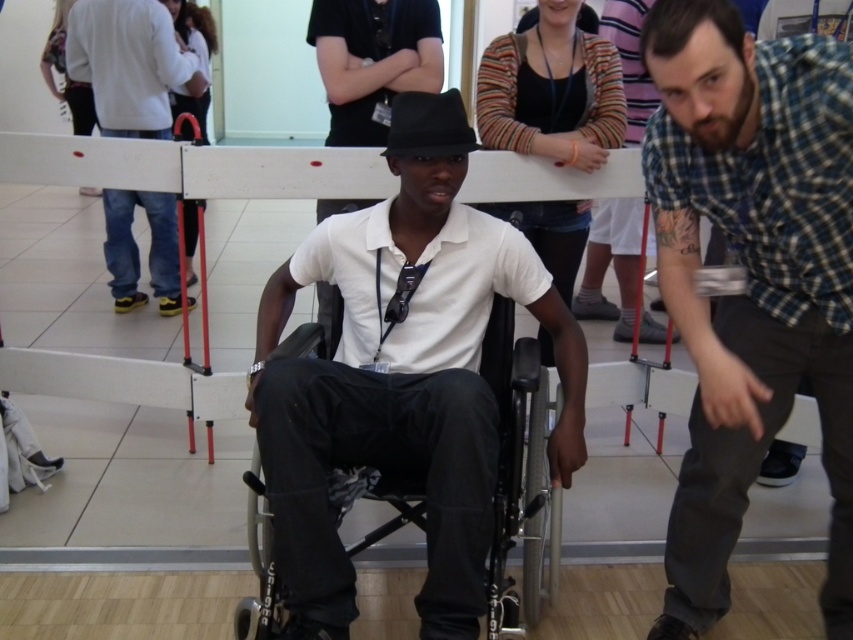
Question: Which object is the farthest from the checkered fabric shirt at right?

Choices:
 (A) jeans at left
 (B) black plastic wheelchair at center

Answer: (A)

Question: Which object appears closest to the camera in this image?

Choices:
 (A) jeans at left
 (B) checkered fabric shirt at right

Answer: (B)

Question: Which object appears closest to the camera in this image?

Choices:
 (A) jeans at left
 (B) black plastic wheelchair at center
 (C) checkered fabric shirt at right

Answer: (C)

Question: Can you confirm if black plastic wheelchair at center is thinner than jeans at left?

Choices:
 (A) yes
 (B) no

Answer: (B)

Question: Is checkered fabric shirt at right above black plastic wheelchair at center?

Choices:
 (A) yes
 (B) no

Answer: (A)

Question: Can you confirm if checkered fabric shirt at right is positioned to the left of black plastic wheelchair at center?

Choices:
 (A) no
 (B) yes

Answer: (A)